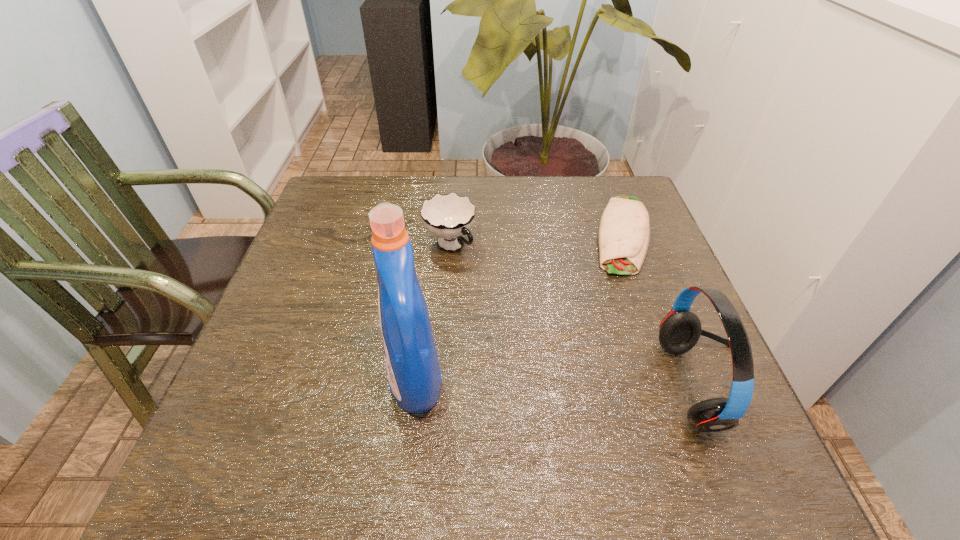
I want to click on vacant region at the far edge of the desktop, so click(512, 190).

Find the location of `vacant space at the near edge of the desktop`. vacant space at the near edge of the desktop is located at coordinates (375, 426).

At what (x,y) coordinates should I click in order to perform the action: click on free space at the left edge. Please return your answer as a coordinate pair (x, y). The height and width of the screenshot is (540, 960). Looking at the image, I should click on (334, 319).

What are the coordinates of `free location at the right edge` in the screenshot? It's located at (624, 299).

The width and height of the screenshot is (960, 540). In order to click on blank space at the far left corner of the desktop in this screenshot , I will do `click(344, 200)`.

In the image, there is a desktop. In order to click on free space at the near left corner in this screenshot , I will do `click(242, 427)`.

Where is `free space at the far right corner of the desktop`? Image resolution: width=960 pixels, height=540 pixels. free space at the far right corner of the desktop is located at coordinates (607, 181).

Where is `vacant space in between the tallest object and the headset`? Image resolution: width=960 pixels, height=540 pixels. vacant space in between the tallest object and the headset is located at coordinates (564, 384).

Locate an element on the screen. free space between the second tallest object and the burrito is located at coordinates (667, 310).

Locate an element on the screen. free space between the second shortest object and the third shortest object is located at coordinates (581, 316).